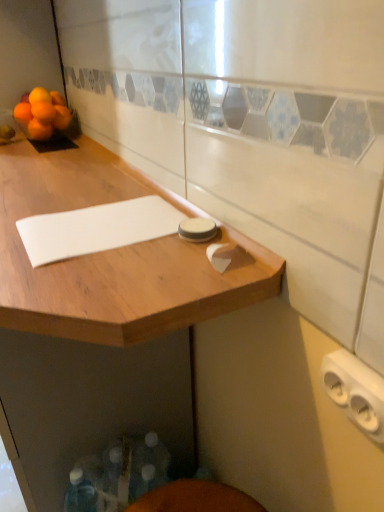
This screenshot has width=384, height=512. I want to click on free location in front of white matte notepad at center, so click(100, 276).